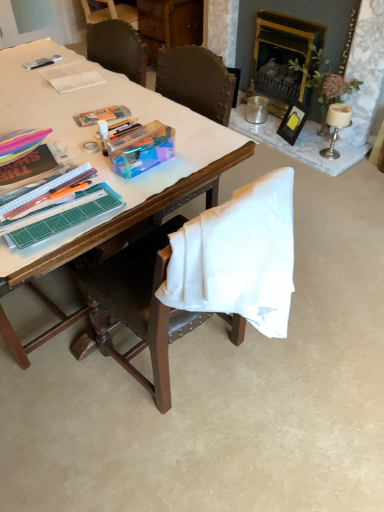
Question: Does wooden chair at center turn towards white paper at upper left?

Choices:
 (A) yes
 (B) no

Answer: (A)

Question: Would you consider wooden chair at center to be distant from white paper at upper left?

Choices:
 (A) yes
 (B) no

Answer: (A)

Question: Is wooden chair at center to the right of white paper at upper left from the viewer's perspective?

Choices:
 (A) no
 (B) yes

Answer: (B)

Question: Considering the relative sizes of wooden chair at center and white paper at upper left in the image provided, is wooden chair at center thinner than white paper at upper left?

Choices:
 (A) yes
 (B) no

Answer: (B)

Question: From a real-world perspective, does wooden chair at center sit lower than white paper at upper left?

Choices:
 (A) yes
 (B) no

Answer: (A)

Question: Considering the positions of metallic silver pen at upper left and white paper at upper left in the image, is metallic silver pen at upper left bigger or smaller than white paper at upper left?

Choices:
 (A) big
 (B) small

Answer: (B)

Question: Would you say metallic silver pen at upper left is to the left or to the right of white paper at upper left in the picture?

Choices:
 (A) left
 (B) right

Answer: (A)

Question: From their relative heights in the image, would you say metallic silver pen at upper left is taller or shorter than white paper at upper left?

Choices:
 (A) short
 (B) tall

Answer: (A)

Question: Looking at their shapes, would you say metallic silver pen at upper left is wider or thinner than white paper at upper left?

Choices:
 (A) thin
 (B) wide

Answer: (A)

Question: From a real-world perspective, is metallic silver pen at upper left positioned above or below wooden chair at center?

Choices:
 (A) above
 (B) below

Answer: (A)

Question: In terms of size, does metallic silver pen at upper left appear bigger or smaller than wooden chair at center?

Choices:
 (A) small
 (B) big

Answer: (A)

Question: Is metallic silver pen at upper left taller or shorter than wooden chair at center?

Choices:
 (A) tall
 (B) short

Answer: (B)

Question: Is point (54, 57) positioned closer to the camera than point (258, 302)?

Choices:
 (A) farther
 (B) closer

Answer: (A)

Question: Based on their sizes in the image, would you say wooden desk at center is bigger or smaller than gold-framed fireplace at upper right?

Choices:
 (A) big
 (B) small

Answer: (A)

Question: Would you say wooden desk at center is to the left or to the right of gold-framed fireplace at upper right in the picture?

Choices:
 (A) right
 (B) left

Answer: (B)